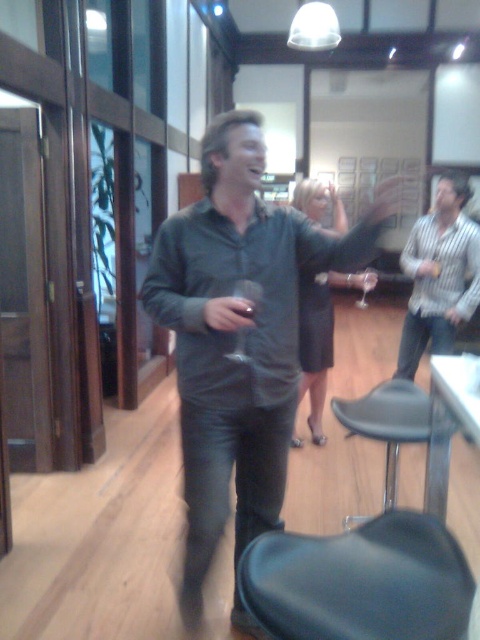
You are at a party and want to hand a drink to both the matte gray shirt at center and the striped shirt at right. Since you have only one drink, you need to decide who to give it to first based on their height. Who should you give it to first?

The matte gray shirt at center is much taller than the striped shirt at right, so you should give the drink to the matte gray shirt at center first because they are taller.

You are at a party and see two striped shirts in the room. One is the striped shirt at right and the other is the striped cotton shirt at upper right. Which striped shirt is positioned more to the right side of the room?

The striped shirt at right is positioned more to the right side of the room compared to the striped cotton shirt at upper right.

Based on the photo, you are organizing a photo shoot and need to place a backdrop behind the matte gray shirt at center and the striped shirt at right. The backdrop is 1.8 meters wide. Can both shirts fit side by side within the backdrop without overlapping?

The matte gray shirt at center might be wider than striped shirt at right, so it is uncertain if both can fit side by side within the 1.8 meters backdrop. The width of the matte gray shirt at center compared to the striped shirt at right is unknown, so the total required width cannot be determined precisely.